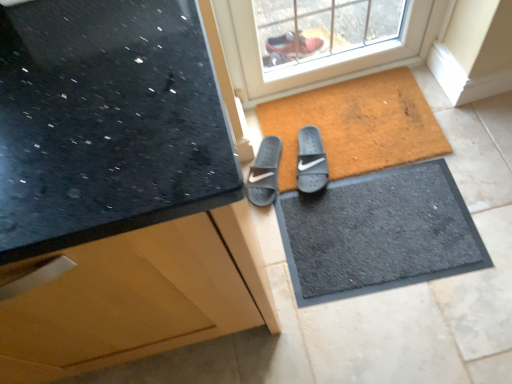
Locate an element on the screen. The width and height of the screenshot is (512, 384). vacant space underneath brown textured mat at center (from a real-world perspective) is located at coordinates (382, 122).